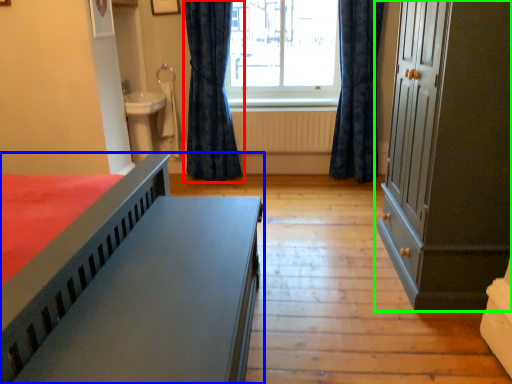
Question: Estimate the real-world distances between objects in this image. Which object is farther from curtain (highlighted by a red box), bed (highlighted by a blue box) or cupboard (highlighted by a green box)?

Choices:
 (A) bed
 (B) cupboard

Answer: (A)